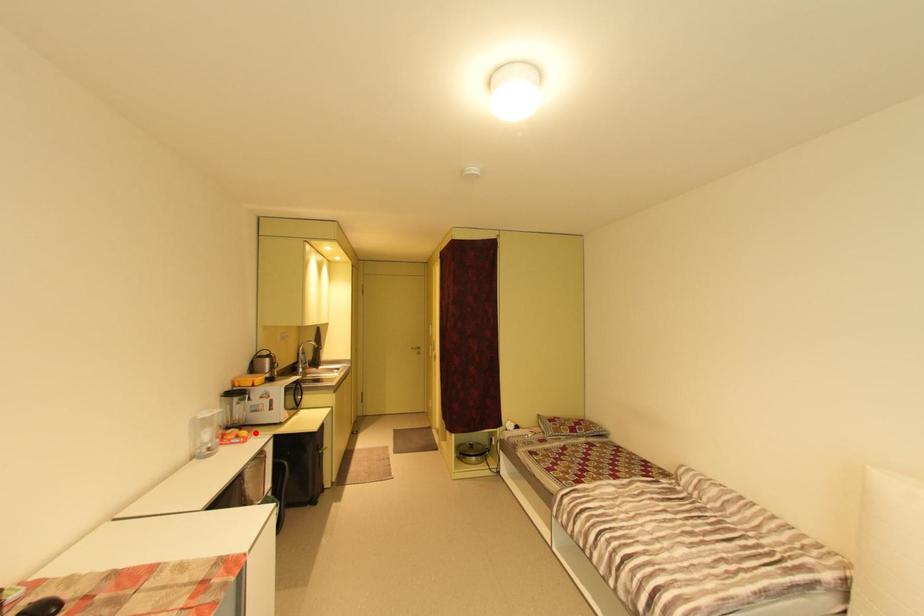
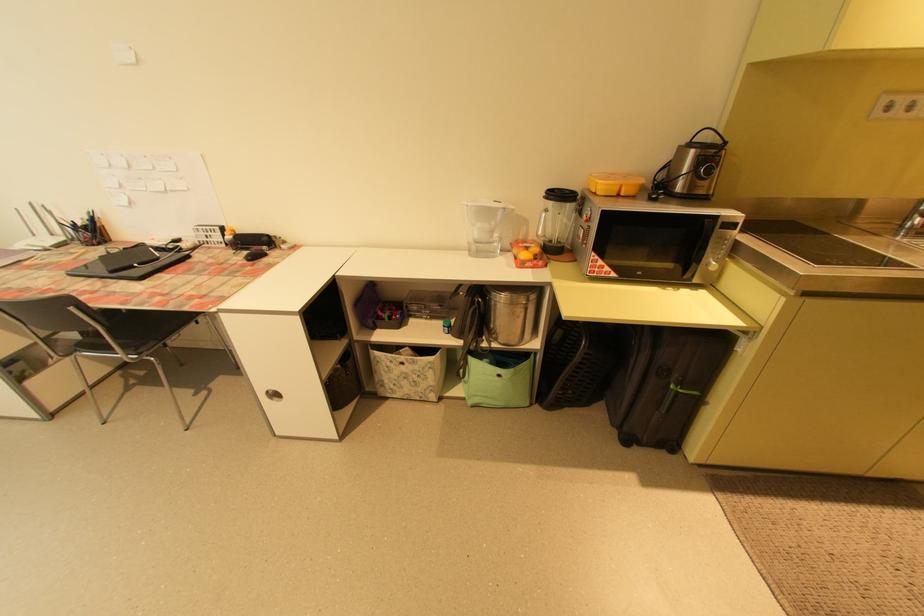
Find the pixel in the second image that matches the highlighted location in the first image.

(541, 259)